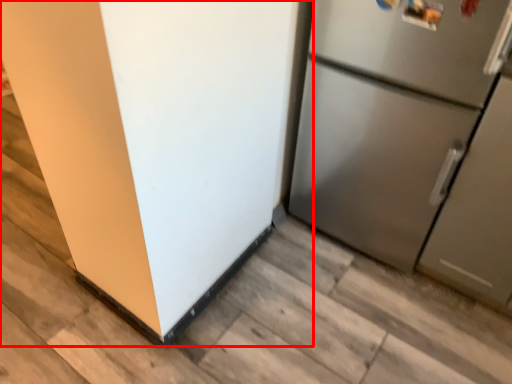
Question: Considering the relative positions of refrigerator (annotated by the red box) and refrigerator in the image provided, where is refrigerator (annotated by the red box) located with respect to the staircase?

Choices:
 (A) right
 (B) left

Answer: (B)